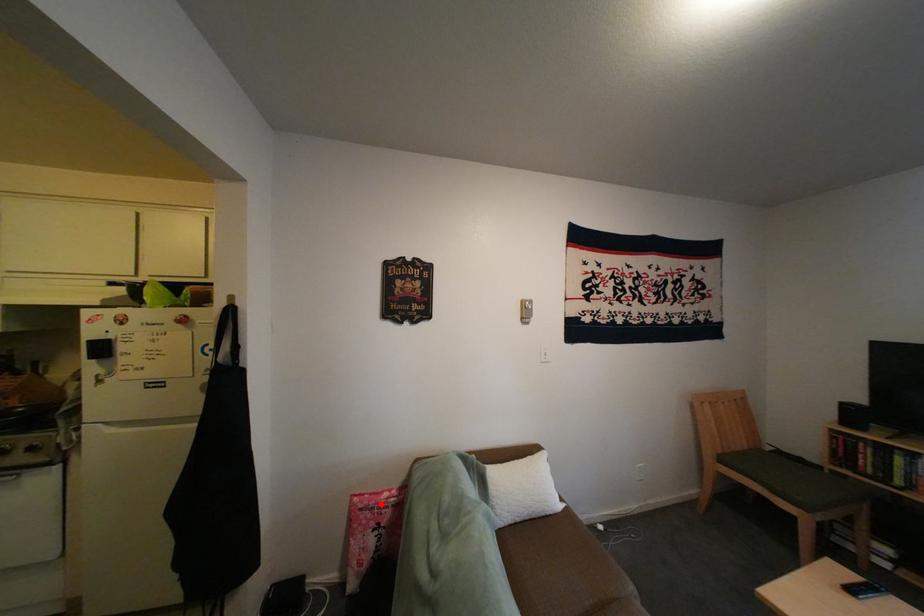
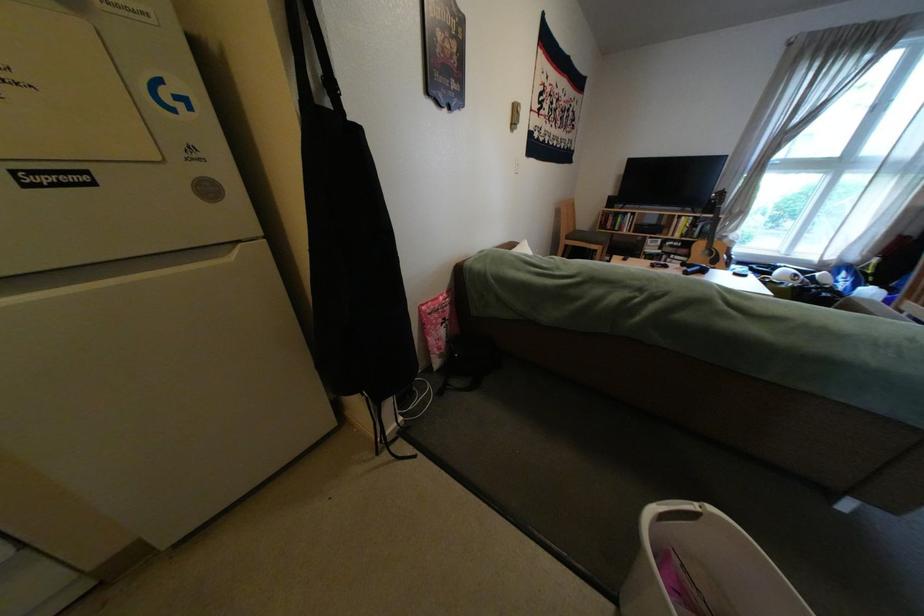
Find the pixel in the second image that matches the highlighted location in the first image.

(446, 309)